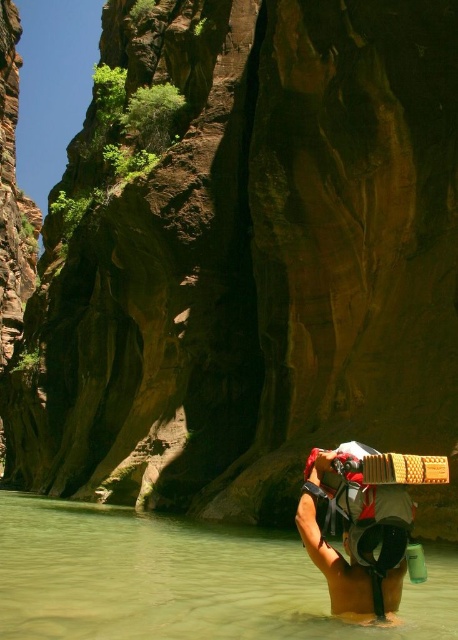
You are a hiker who needs to cross the canyon. You see the clear water at center and the white fabric backpack at lower center. Which object is closer to you?

The white fabric backpack at lower center is closer to you since it is only 10.32 meters away from the clear water at center, but since the backpack is at lower center, it is positioned nearer to the observer compared to the water at center.

You are a hiker who just arrived at the canyon. You see the clear water at center and the white fabric backpack at lower center. Which object is positioned to the left of the other?

The clear water at center is to the left of the white fabric backpack at lower center.

You are a hiker planning to cross the clear water at center while carrying your white fabric backpack at lower center. Based on the width of the water and backpack, can you safely cross without the backpack getting submerged?

The clear water at center might be wider than white fabric backpack at lower center, so there is a possibility that the backpack won me be submerged. However, since the water is calm and the backpack is at lower center, it might be safe to cross carefully.